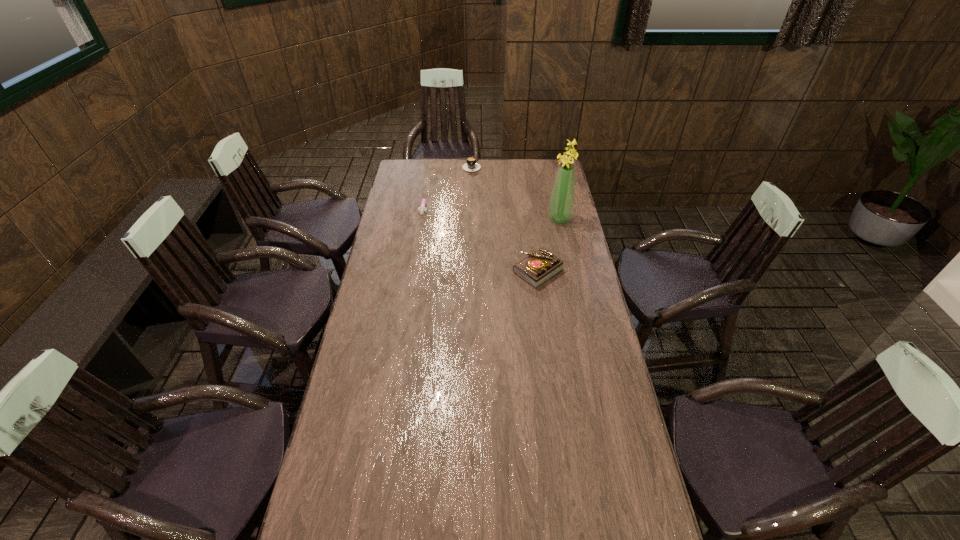
Image resolution: width=960 pixels, height=540 pixels. Find the location of `blank space located on the front-facing side of the tallest object`. blank space located on the front-facing side of the tallest object is located at coordinates (498, 228).

At what (x,y) coordinates should I click in order to perform the action: click on vacant space located with the handle on the side of the third object from right to left. Please return your answer as a coordinate pair (x, y). The height and width of the screenshot is (540, 960). Looking at the image, I should click on (472, 178).

Identify the location of vacant space located with the handle on the side of the third object from right to left. The height and width of the screenshot is (540, 960). (474, 200).

Image resolution: width=960 pixels, height=540 pixels. I want to click on free spot located with the handle on the side of the third object from right to left, so click(x=475, y=201).

This screenshot has width=960, height=540. Find the location of `object situated at the far edge`. object situated at the far edge is located at coordinates (471, 165).

Image resolution: width=960 pixels, height=540 pixels. Identify the location of object at the left edge. (422, 209).

Find the location of a particular element. This screenshot has width=960, height=540. diary located in the right edge section of the desktop is located at coordinates (537, 268).

Locate an element on the screen. The image size is (960, 540). bouquet at the right edge is located at coordinates (561, 204).

Locate an element on the screen. This screenshot has height=540, width=960. vacant space at the far edge of the desktop is located at coordinates (503, 181).

In the image, there is a desktop. Where is `vacant region at the near edge`? The width and height of the screenshot is (960, 540). vacant region at the near edge is located at coordinates (462, 536).